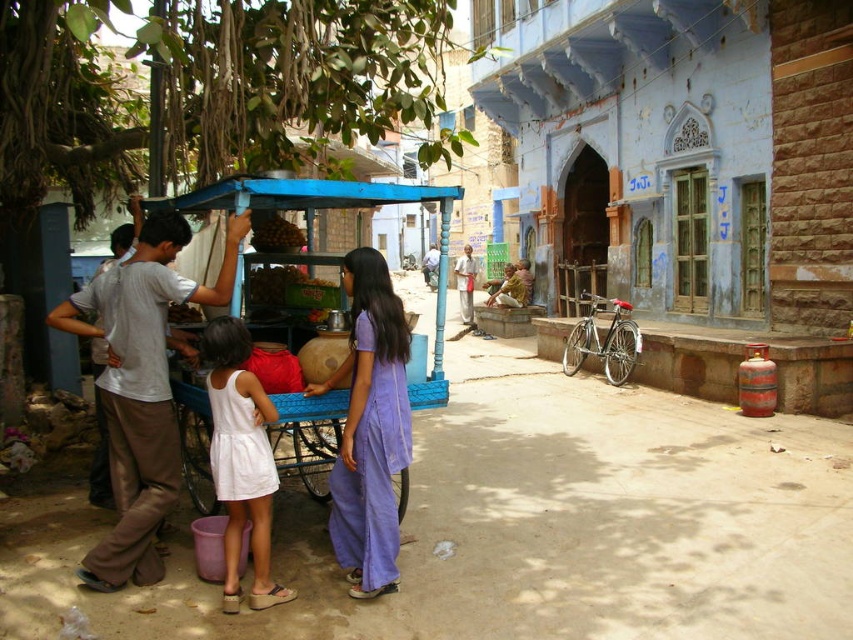
Question: Is purple cotton dress at center to the right of blue painted wood cart at center from the viewer's perspective?

Choices:
 (A) no
 (B) yes

Answer: (B)

Question: Which point is closer to the camera?

Choices:
 (A) smooth brown nuts at center
 (B) blue painted wood cart at center
 (C) purple cotton dress at center

Answer: (B)

Question: Which point is farther to the camera?

Choices:
 (A) blue painted wood cart at center
 (B) smooth brown nuts at center
 (C) white cotton shirt at left
 (D) light brown cotton shirt at center

Answer: (D)

Question: Can you confirm if smooth brown nuts at center is positioned to the left of light brown cotton shirt at center?

Choices:
 (A) no
 (B) yes

Answer: (B)

Question: Based on their relative distances, which object is farther from the blue painted wood cart at center?

Choices:
 (A) white cotton dress at lower left
 (B) light brown cotton shirt at center
 (C) smooth brown nuts at center

Answer: (B)

Question: Is purple cotton dress at center behind light brown cotton shirt at center?

Choices:
 (A) yes
 (B) no

Answer: (B)